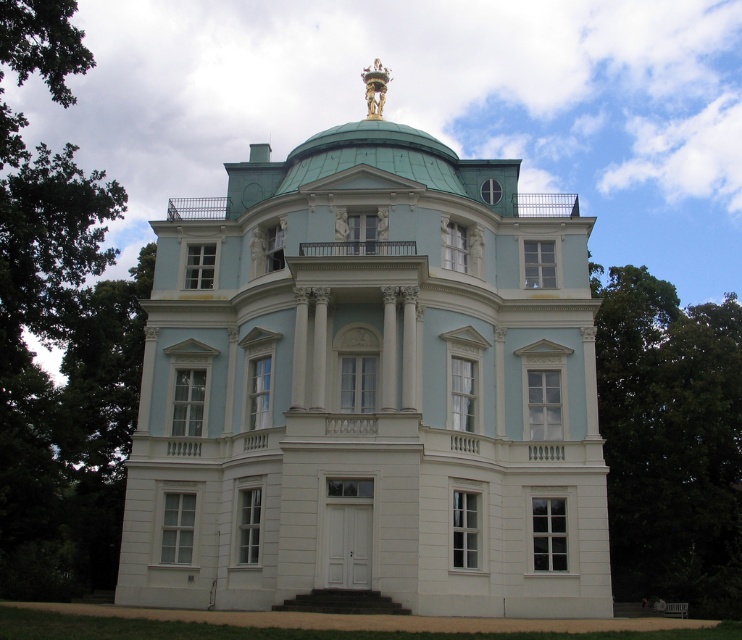
Question: Can you confirm if light blue stone mansion at center is thinner than green metallic dome at center?

Choices:
 (A) no
 (B) yes

Answer: (A)

Question: Can you confirm if light blue stone mansion at center is positioned to the right of green metallic dome at center?

Choices:
 (A) yes
 (B) no

Answer: (B)

Question: Which object appears farthest from the camera in this image?

Choices:
 (A) light blue stone mansion at center
 (B) green metallic dome at center

Answer: (B)

Question: Can you confirm if light blue stone mansion at center is positioned to the left of green metallic dome at center?

Choices:
 (A) yes
 (B) no

Answer: (A)

Question: Which point is closer to the camera?

Choices:
 (A) green metallic dome at center
 (B) light blue stone mansion at center

Answer: (B)